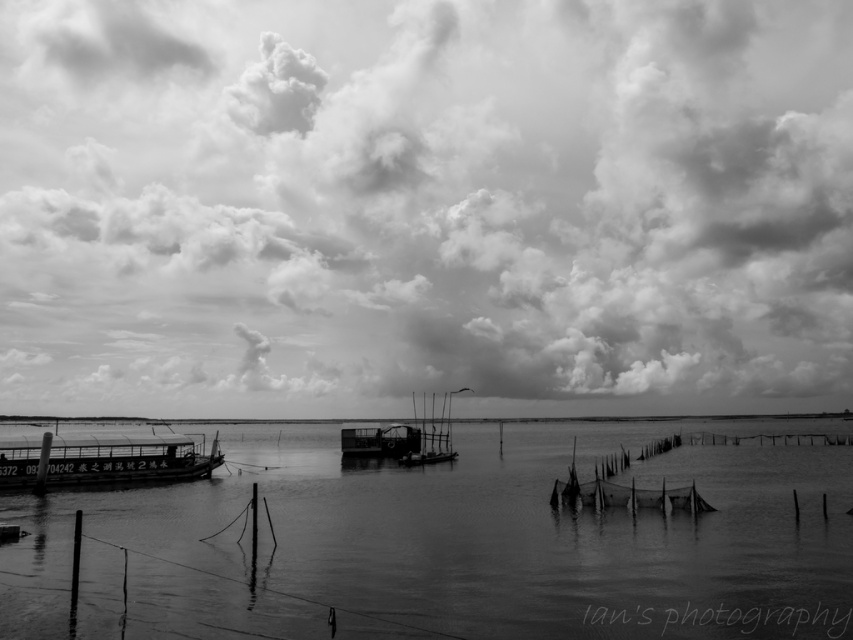
You are standing at the point closest to the viewer in the image. Which of the two points, point (51,280) or point (361,445), are you standing at?

You are standing at point (51,280) because it is further to the viewer than point (361,445).

You are standing on the dock and looking at the cloudy sky at upper center and the metallic boat at center. Which object is closer to you?

The cloudy sky at upper center is closer to you because it is further to the viewer than the metallic boat at center.